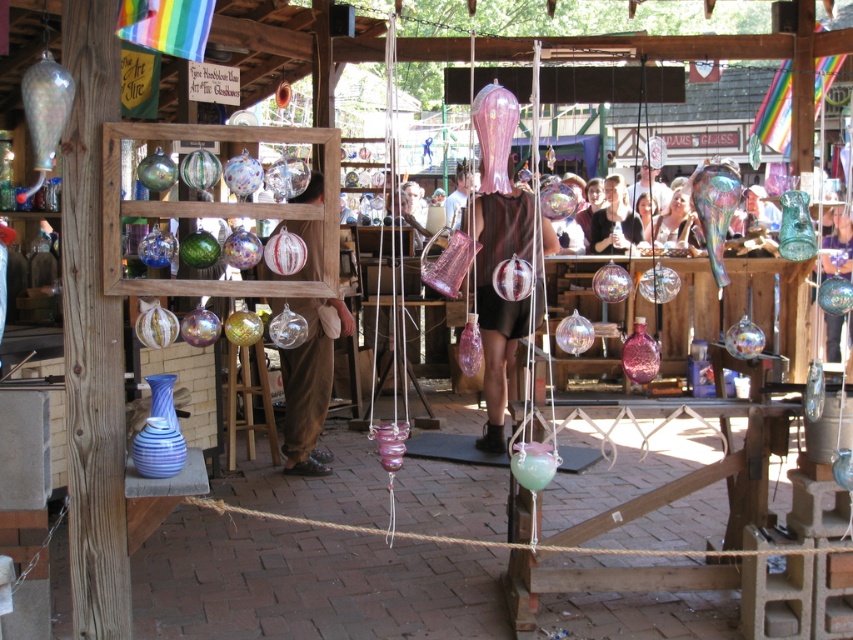
Can you confirm if brown rope at center is taller than matte black shirt at center?

No, brown rope at center is not taller than matte black shirt at center.

Is point (432, 540) closer to camera compared to point (619, 244)?

Yes.

Is point (708, 552) farther from camera compared to point (606, 182)?

No, it is in front of (606, 182).

Identify the location of brown rope at center. The height and width of the screenshot is (640, 853). (502, 541).

Which is more to the right, translucent pink glass vase at center or matte black shirt at center?

matte black shirt at center is more to the right.

Does translucent pink glass vase at center come in front of matte black shirt at center?

Yes, translucent pink glass vase at center is in front of matte black shirt at center.

Locate an element on the screen. translucent pink glass vase at center is located at coordinates (500, 298).

Identify the location of translucent pink glass vase at center. The height and width of the screenshot is (640, 853). (500, 298).

Between matte brown pants at center and translucent glass vase at center, which one is positioned lower?

matte brown pants at center is lower down.

Can you confirm if matte brown pants at center is shorter than translucent glass vase at center?

No, matte brown pants at center is not shorter than translucent glass vase at center.

Who is more distant from viewer, (289, 420) or (838, 228)?

The point (838, 228) is more distant.

Where is `matte brown pants at center`? matte brown pants at center is located at coordinates (309, 380).